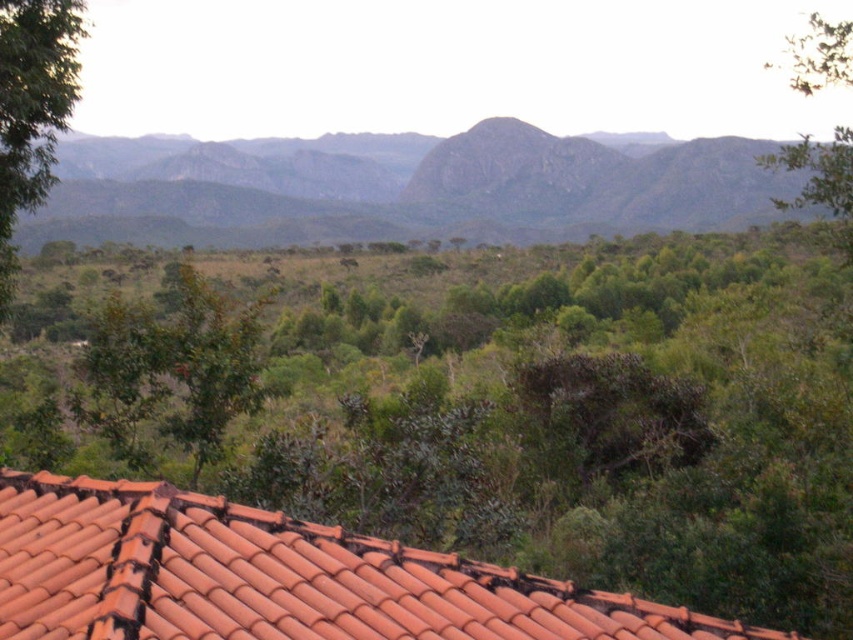
Can you confirm if terracotta tiles at lower center is shorter than green leafy tree at left?

Yes.

Looking at this image, measure the distance between point (103, 592) and camera.

Point (103, 592) is 6.26 meters away from camera.

I want to click on terracotta tiles at lower center, so click(273, 577).

From the picture: Can you confirm if terracotta tiles at lower center is positioned to the left of rugged granite mountain at center?

Incorrect, terracotta tiles at lower center is not on the left side of rugged granite mountain at center.

At what (x,y) coordinates should I click in order to perform the action: click on terracotta tiles at lower center. Please return your answer as a coordinate pair (x, y). Image resolution: width=853 pixels, height=640 pixels. Looking at the image, I should click on (273, 577).

Can you confirm if rugged granite mountain at center is bigger than green leafy tree at left?

Indeed, rugged granite mountain at center has a larger size compared to green leafy tree at left.

Which is above, rugged granite mountain at center or green leafy tree at left?

rugged granite mountain at center is above.

Identify the location of rugged granite mountain at center. The height and width of the screenshot is (640, 853). (445, 195).

The image size is (853, 640). I want to click on rugged granite mountain at center, so click(445, 195).